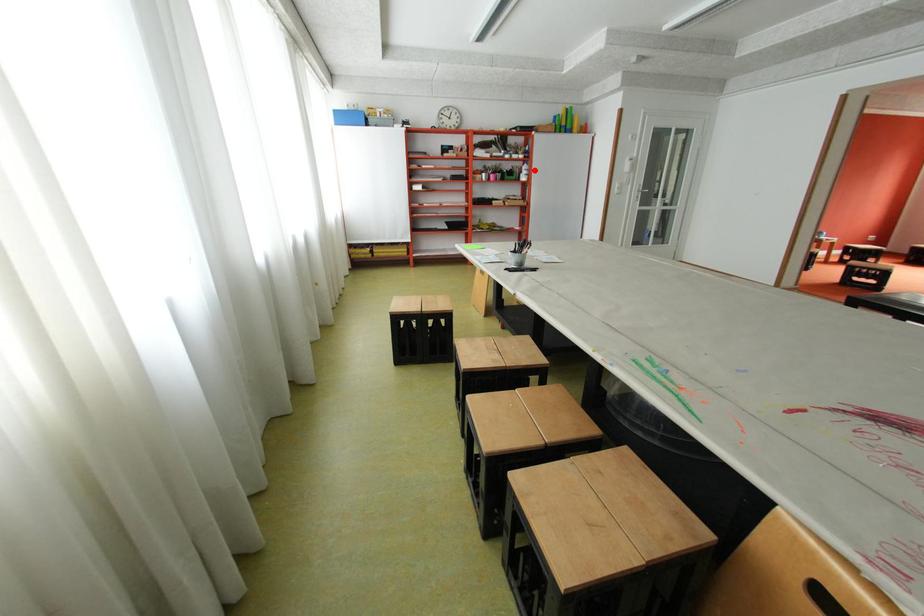
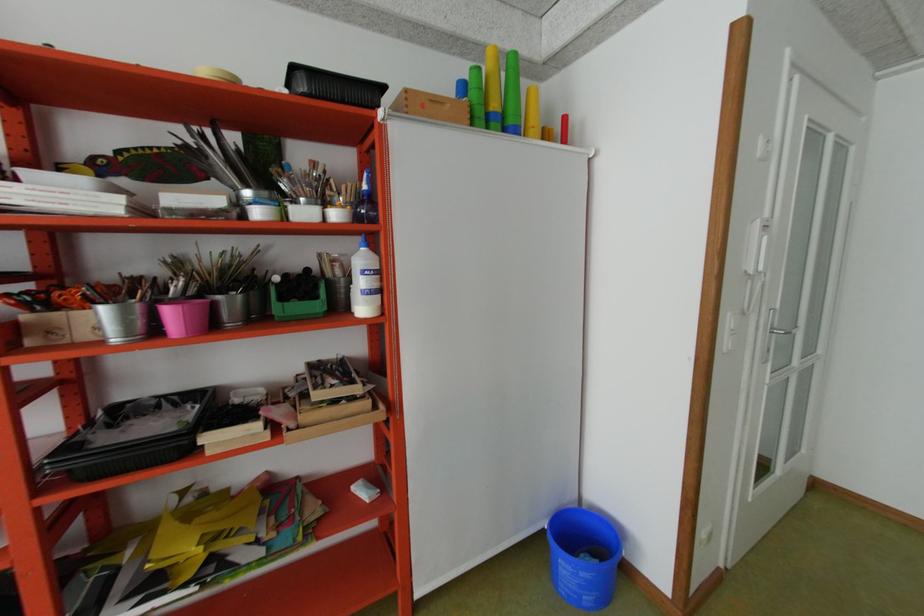
Where in the second image is the point corresponding to the highlighted location from the first image?

(372, 273)